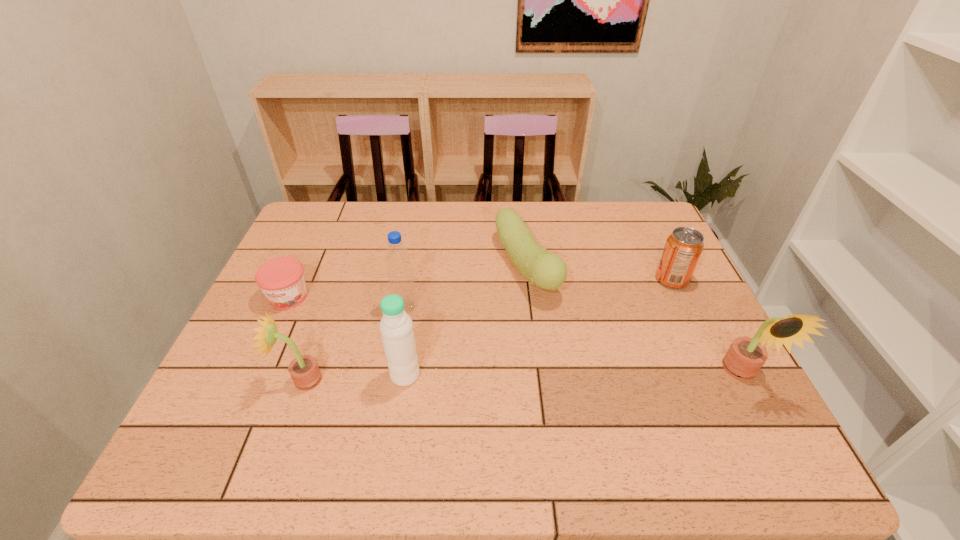
At what (x,y) coordinates should I click in order to perform the action: click on the fourth tallest object. Please return your answer as a coordinate pair (x, y). Looking at the image, I should click on (304, 370).

Where is `the left sunflower`? the left sunflower is located at coordinates (304, 370).

The height and width of the screenshot is (540, 960). I want to click on the right sunflower, so click(x=745, y=357).

This screenshot has height=540, width=960. What are the coordinates of `the fifth object from left to right` in the screenshot? It's located at (548, 271).

You are a GUI agent. You are given a task and a screenshot of the screen. Output one action in this format:
    pyautogui.click(x=<x>, y=<y>)
    Task: Click on the second shortest object
    The width and height of the screenshot is (960, 540).
    Given the screenshot: What is the action you would take?
    pyautogui.click(x=548, y=271)

At what (x,y) coordinates should I click in order to perform the action: click on the farther water bottle. Please return your answer as a coordinate pair (x, y). Looking at the image, I should click on (397, 258).

Where is `soda can`? The width and height of the screenshot is (960, 540). soda can is located at coordinates (684, 246).

Find the location of a particular element. the shortest object is located at coordinates (281, 279).

You are a GUI agent. You are given a task and a screenshot of the screen. Output one action in this format:
    pyautogui.click(x=<x>, y=<y>)
    Task: Click on the jam
    The image size is (960, 540).
    Given the screenshot: What is the action you would take?
    pyautogui.click(x=281, y=279)

Locate an element on the screen. the nearer water bottle is located at coordinates (396, 326).